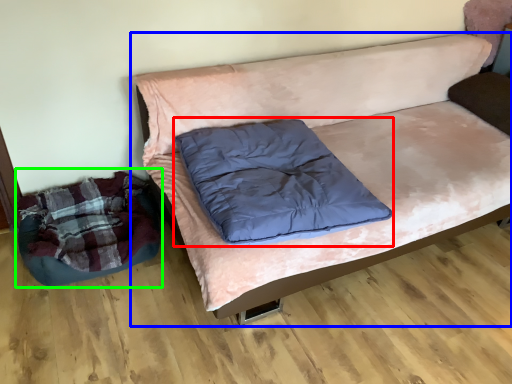
Question: Considering the real-world distances, which object is farthest from pillow (highlighted by a red box)? studio couch (highlighted by a blue box) or bean bag chair (highlighted by a green box)?

Choices:
 (A) studio couch
 (B) bean bag chair

Answer: (B)